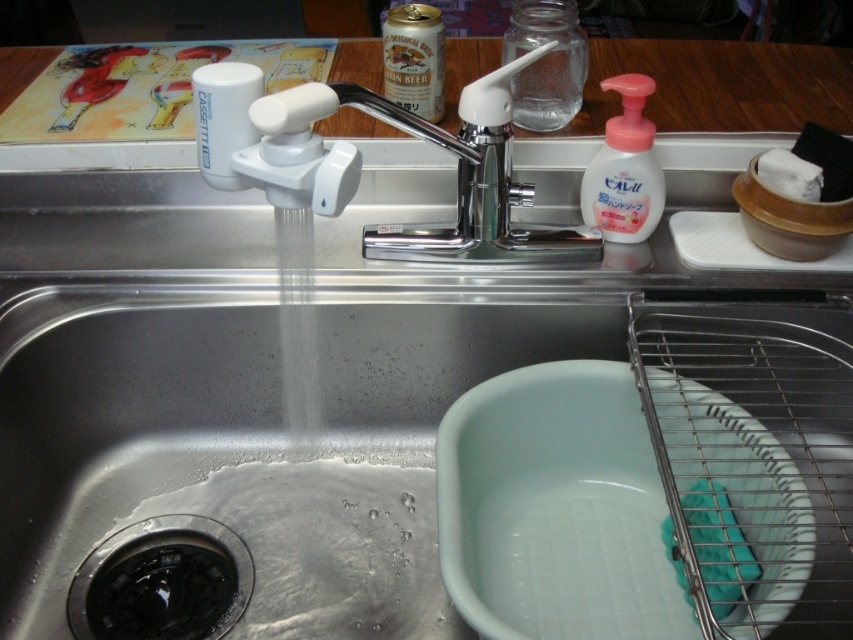
Question: Can you confirm if black rubber drain at lower left is smaller than metallic can at upper center?

Choices:
 (A) no
 (B) yes

Answer: (B)

Question: Which object is positioned closest to the black rubber drain at lower left?

Choices:
 (A) white matte plate at right
 (B) clear liquid water at faucet center
 (C) transparent glass jar at upper center
 (D) pink plastic soap dispenser at upper right

Answer: (B)

Question: Does metallic can at upper center appear on the left side of white foam soap at right?

Choices:
 (A) yes
 (B) no

Answer: (A)

Question: Which object is closer to the camera taking this photo?

Choices:
 (A) pink plastic soap dispenser at upper right
 (B) metallic can at upper center
 (C) clear liquid water at faucet center

Answer: (A)

Question: Is black rubber drain at lower left above clear liquid water at faucet center?

Choices:
 (A) yes
 (B) no

Answer: (B)

Question: Which object is the closest to the pink plastic soap dispenser at upper right?

Choices:
 (A) black rubber drain at lower left
 (B) clear liquid water at faucet center
 (C) white foam soap at right
 (D) metallic can at upper center

Answer: (C)